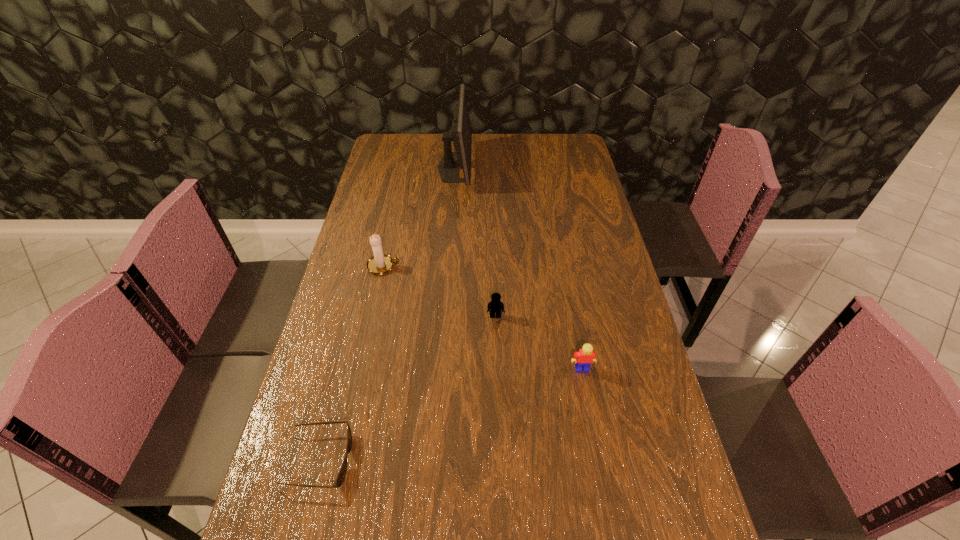
I want to click on free space at the left edge of the desktop, so click(x=284, y=522).

The height and width of the screenshot is (540, 960). In the image, there is a desktop. In order to click on free region at the right edge in this screenshot , I will do `click(607, 444)`.

The width and height of the screenshot is (960, 540). In the image, there is a desktop. In order to click on vacant space at the far left corner in this screenshot , I will do `click(419, 139)`.

The image size is (960, 540). In order to click on vacant space that is in between the second object from right to left and the candle holder in this screenshot , I will do `click(440, 291)`.

The height and width of the screenshot is (540, 960). I want to click on vacant area that lies between the shortest object and the second shortest object, so click(x=406, y=388).

Identify the location of vacant area that lies between the tallest object and the nearest object. (386, 314).

Find the location of a particular element. The image size is (960, 540). free space between the fourth farthest object and the left Lego is located at coordinates (539, 342).

Where is `empty space that is in between the nearest object and the third nearest object`? This screenshot has width=960, height=540. empty space that is in between the nearest object and the third nearest object is located at coordinates (406, 388).

Where is `free space between the computer monitor and the sunglasses`? This screenshot has height=540, width=960. free space between the computer monitor and the sunglasses is located at coordinates (386, 314).

This screenshot has height=540, width=960. Identify the location of unoccupied area between the sunglasses and the candle holder. (350, 363).